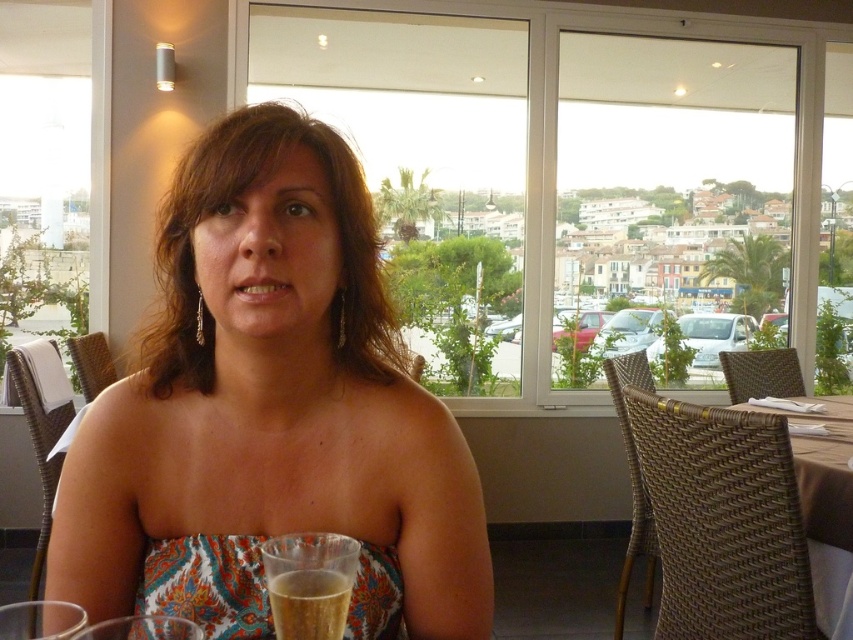
You are a customer sitting at the brown woven table at right in a coastal town restaurant. You want to see the scenic view through the transparent glass window at center. Can you see the view clearly from your seat?

The brown woven table at right is behind the transparent glass window at center, so you can see the scenic view through the transparent glass window at center from your seat.

You are a photographer taking a picture of the printed fabric dress at lower center and the translucent plastic cup at lower center. To ensure both are in focus, you need to know their positions relative to each other. Which object is positioned to the left?

The printed fabric dress at lower center is to the left of the translucent plastic cup at lower center, so the printed fabric dress at lower center is positioned to the left.

You are a photographer trying to capture the scenic view through the transparent glass window at center while also including the multicolored fabric dress at center in the frame. Which object should you focus on first to ensure both are in focus?

You should focus on the transparent glass window at center first because it is closer to you than the multicolored fabric dress at center, so focusing on the closer object will help ensure both are in focus.